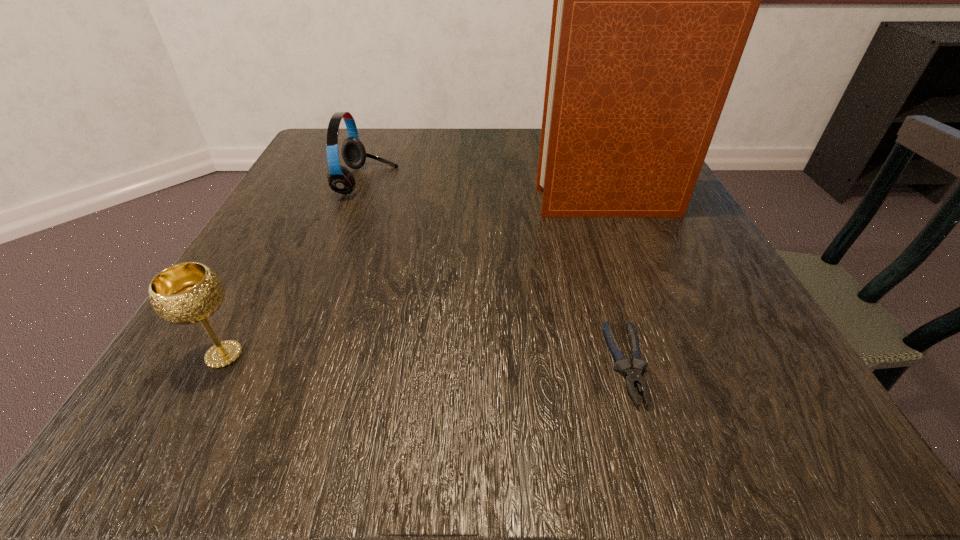
Locate an element on the screen. This screenshot has width=960, height=540. vacant space in between the pliers and the leftmost object is located at coordinates (426, 360).

At what (x,y) coordinates should I click in order to perform the action: click on blank region between the chalice and the third object from right to left. Please return your answer as a coordinate pair (x, y). This screenshot has width=960, height=540. Looking at the image, I should click on (296, 268).

At what (x,y) coordinates should I click in order to perform the action: click on unoccupied area between the hardback book and the chalice. Please return your answer as a coordinate pair (x, y). The image size is (960, 540). Looking at the image, I should click on (417, 279).

Find the location of a particular element. empty space between the headset and the chalice is located at coordinates (296, 268).

Select which object appears as the closest to the leftmost object. Please provide its 2D coordinates. Your answer should be formatted as a tuple, i.e. [(x, y)], where the tuple contains the x and y coordinates of a point satisfying the conditions above.

[(341, 180)]

I want to click on the third closest object to the pliers, so click(341, 180).

Identify the location of free space that satisfies the following two spatial constraints: 1. on the open cover of the hardback book; 2. at the gripping part of the shortest object. The height and width of the screenshot is (540, 960). (675, 364).